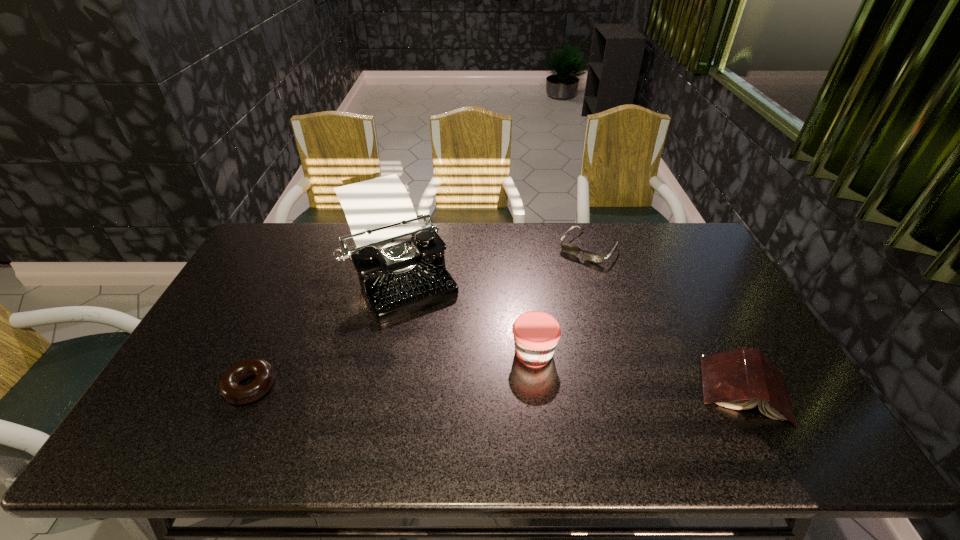
The height and width of the screenshot is (540, 960). Identify the location of the leftmost object. (229, 387).

The height and width of the screenshot is (540, 960). Identify the location of the rightmost object. (739, 379).

Locate an element on the screen. book is located at coordinates (739, 379).

Find the location of `the third object from left to right`. the third object from left to right is located at coordinates (536, 333).

Where is `jam`? The image size is (960, 540). jam is located at coordinates (536, 333).

Identify the location of the fourth object from right to left. The image size is (960, 540). (401, 268).

At what (x,y) coordinates should I click in order to perform the action: click on the tallest object. Please return your answer as a coordinate pair (x, y). This screenshot has width=960, height=540. Looking at the image, I should click on (401, 268).

Locate an element on the screen. This screenshot has height=540, width=960. sunglasses is located at coordinates (569, 248).

Locate an element on the screen. The height and width of the screenshot is (540, 960). free spot located on the right of the doughnut is located at coordinates (381, 387).

This screenshot has height=540, width=960. Find the location of `free location located on the back of the rightmost object`. free location located on the back of the rightmost object is located at coordinates (710, 326).